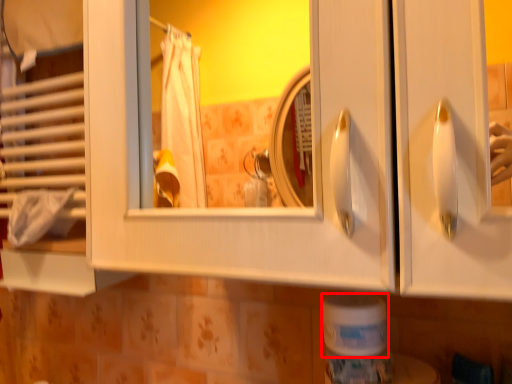
Question: From the image's perspective, where is toilet paper (annotated by the red box) located in relation to bath towel in the image?

Choices:
 (A) above
 (B) below

Answer: (B)